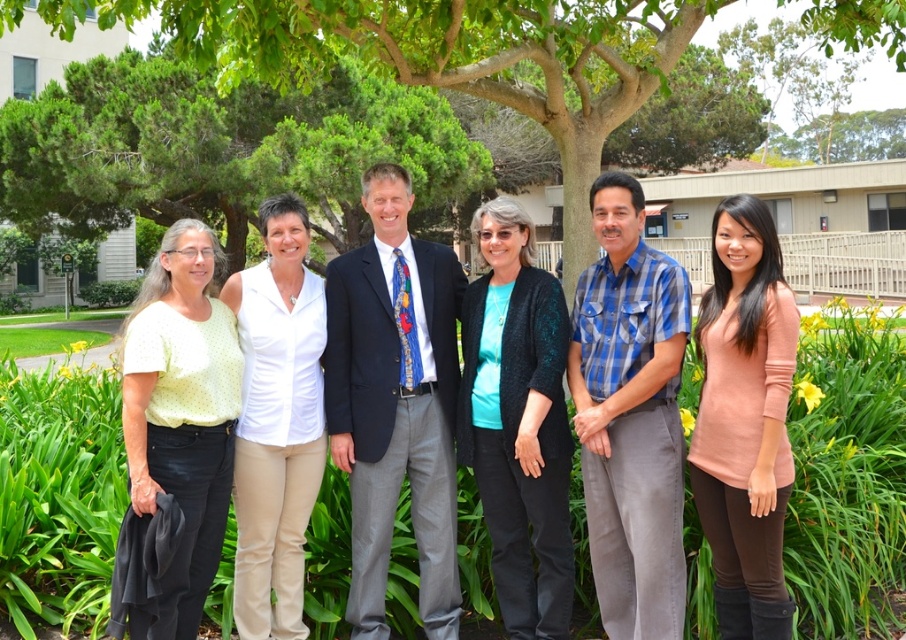
Does dark blue suit at center appear on the left side of blue plaid shirt at center?

Indeed, dark blue suit at center is positioned on the left side of blue plaid shirt at center.

From the picture: Is dark blue suit at center thinner than blue plaid shirt at center?

No, dark blue suit at center is not thinner than blue plaid shirt at center.

The image size is (906, 640). Find the location of `dark blue suit at center`. dark blue suit at center is located at coordinates (394, 403).

Does green leafy tree at center have a greater width compared to white smooth shirt at center?

Yes, green leafy tree at center is wider than white smooth shirt at center.

Does green leafy tree at center appear on the right side of white smooth shirt at center?

Yes, green leafy tree at center is to the right of white smooth shirt at center.

Is point (450, 74) closer to viewer compared to point (244, 497)?

That is False.

This screenshot has height=640, width=906. Find the location of `green leafy tree at center`. green leafy tree at center is located at coordinates (446, 54).

Which is more to the right, matte white blouse at center or blue plaid shirt at center?

From the viewer's perspective, blue plaid shirt at center appears more on the right side.

Which is in front, point (635, 557) or point (642, 593)?

Point (642, 593)

Identify the location of matte white blouse at center. (586, 403).